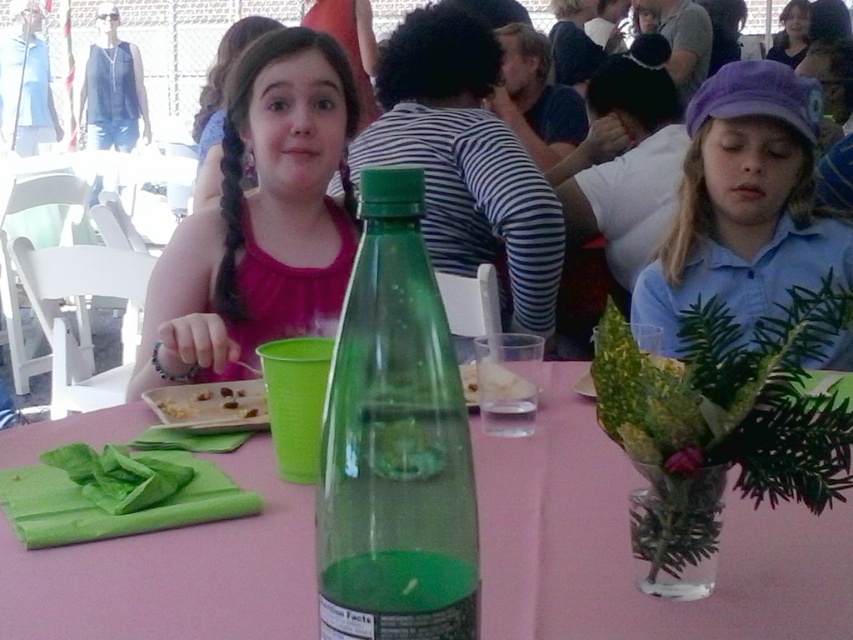
Question: Can you confirm if matte green bottle at center is positioned to the left of matte pink tank top at center?

Choices:
 (A) yes
 (B) no

Answer: (B)

Question: Which object appears closest to the camera in this image?

Choices:
 (A) pink fabric dress at center
 (B) matte pink tank top at center
 (C) yellow crumbly food at center
 (D) white crumbly food at center

Answer: (D)

Question: Is transparent glass bottle at center closer to the viewer compared to matte green bottle at center?

Choices:
 (A) no
 (B) yes

Answer: (B)

Question: Which point appears farthest from the camera in this image?

Choices:
 (A) (294, 212)
 (B) (842, 224)

Answer: (B)

Question: Which object appears closest to the camera in this image?

Choices:
 (A) purple cotton cap at upper right
 (B) matte pink tank top at center
 (C) white crumbly food at center

Answer: (C)

Question: Does matte green bottle at center appear on the right side of yellow crumbly food at center?

Choices:
 (A) no
 (B) yes

Answer: (B)